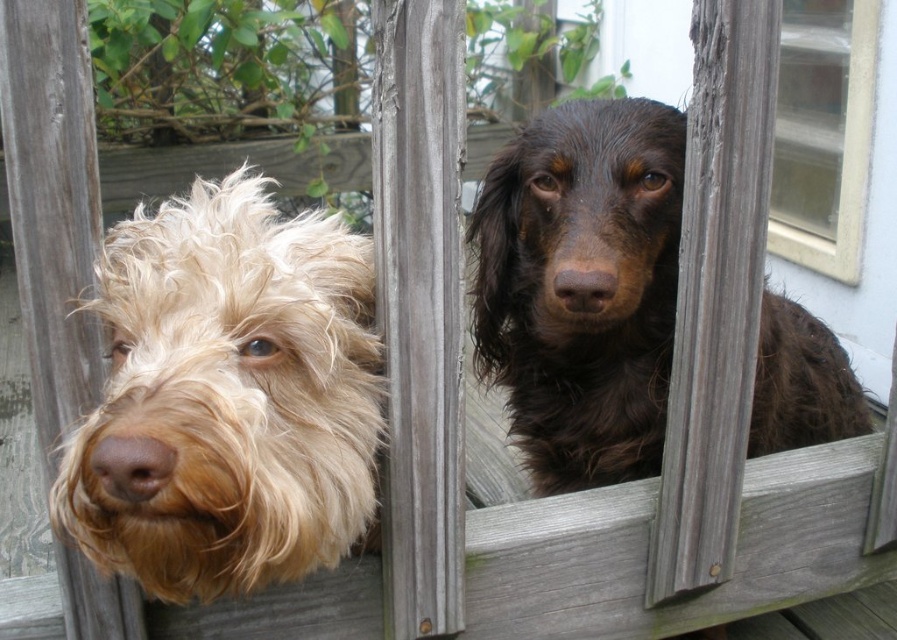
Question: Can you confirm if light brown fur at left is bigger than brown matte nose at left?

Choices:
 (A) no
 (B) yes

Answer: (B)

Question: Which object is the farthest from the white plastic window at upper right?

Choices:
 (A) shiny brown fur at center
 (B) light brown fur at left
 (C) brown matte nose at left
 (D) brown matte nose at center

Answer: (C)

Question: Which point appears closest to the camera in this image?

Choices:
 (A) (649, 387)
 (B) (197, 256)

Answer: (B)

Question: Estimate the real-world distances between objects in this image. Which object is closer to the light brown fur at left?

Choices:
 (A) white plastic window at upper right
 (B) brown matte nose at left
 (C) brown matte nose at center

Answer: (B)

Question: Can you confirm if shiny brown fur at center is positioned to the left of brown matte nose at left?

Choices:
 (A) no
 (B) yes

Answer: (A)

Question: Does shiny brown fur at center have a larger size compared to white plastic window at upper right?

Choices:
 (A) no
 (B) yes

Answer: (B)